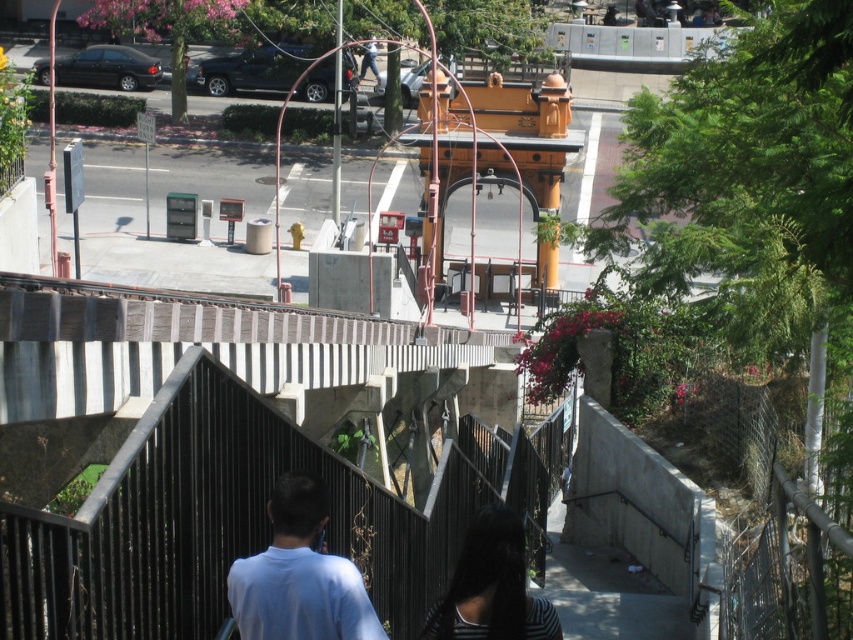
Question: Can you confirm if light blue cotton shirt at center is positioned to the left of light blue t-shirt at center?

Choices:
 (A) no
 (B) yes

Answer: (B)

Question: Which point is farther to the camera?

Choices:
 (A) light blue cotton shirt at center
 (B) dark brown hair at center

Answer: (B)

Question: In this image, where is light blue cotton shirt at center located relative to light blue t-shirt at center?

Choices:
 (A) left
 (B) right

Answer: (A)

Question: Which point is closer to the camera?

Choices:
 (A) (283, 529)
 (B) (314, 579)
 (C) (479, 592)

Answer: (B)

Question: Can you confirm if light blue cotton shirt at center is positioned to the right of light blue t-shirt at center?

Choices:
 (A) no
 (B) yes

Answer: (A)

Question: Which object appears closest to the camera in this image?

Choices:
 (A) dark brown hair at center
 (B) light blue t-shirt at center

Answer: (B)